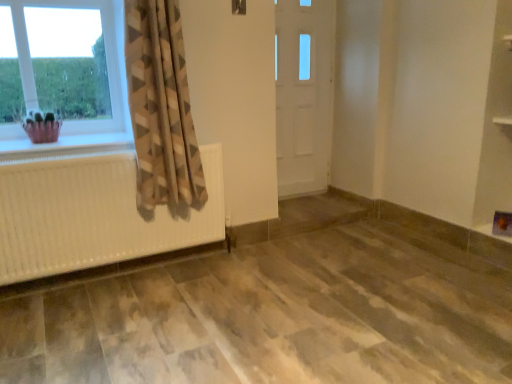
Locate an element on the screen. The height and width of the screenshot is (384, 512). white textured radiator at left is located at coordinates (94, 215).

The height and width of the screenshot is (384, 512). What do you see at coordinates (42, 127) in the screenshot?
I see `pink fabric basket at left` at bounding box center [42, 127].

The height and width of the screenshot is (384, 512). Describe the element at coordinates (65, 146) in the screenshot. I see `white textured radiator at left` at that location.

You are a GUI agent. You are given a task and a screenshot of the screen. Output one action in this format:
    pyautogui.click(x=<x>, y=<y>)
    Task: Click on the beige textured curtain at left
    The width and height of the screenshot is (512, 384).
    Given the screenshot: What is the action you would take?
    pyautogui.click(x=161, y=106)

In order to face clear glass window at upper left, should I rotate leftwards or rightwards?

You should rotate left by 25.451 degrees.

The image size is (512, 384). Find the location of `white textured radiator at left`. white textured radiator at left is located at coordinates (94, 215).

Based on the photo, between pink fabric basket at left and clear glass window at upper left, which one appears on the right side from the viewer's perspective?

pink fabric basket at left is more to the right.

Considering the relative sizes of pink fabric basket at left and clear glass window at upper left in the image provided, is pink fabric basket at left thinner than clear glass window at upper left?

Incorrect, the width of pink fabric basket at left is not less than that of clear glass window at upper left.

Could you tell me if pink fabric basket at left is facing clear glass window at upper left?

No, pink fabric basket at left is not oriented towards clear glass window at upper left.

Looking at this image, which of these two, white textured radiator at left or beige textured curtain at left, is smaller?

Smaller between the two is white textured radiator at left.

From the image's perspective, is white textured radiator at left located above beige textured curtain at left?

No, from the image's perspective, white textured radiator at left is not over beige textured curtain at left.

Would you say white textured radiator at left is a long distance from beige textured curtain at left?

No.

From a real-world perspective, is white textured radiator at left positioned above or below beige textured curtain at left?

From a real-world perspective, white textured radiator at left is physically below beige textured curtain at left.

Which object is closer to the camera, white textured radiator at left or beige textured curtain at left?

Positioned in front is beige textured curtain at left.

Consider the image. Considering the sizes of objects white textured radiator at left and beige textured curtain at left in the image provided, who is bigger, white textured radiator at left or beige textured curtain at left?

With larger size is beige textured curtain at left.

Between white textured radiator at left and beige textured curtain at left, which one has larger width?

white textured radiator at left is wider.

Between white textured radiator at left and beige textured curtain at left, which one appears on the right side from the viewer's perspective?

beige textured curtain at left is more to the right.

I want to click on door that is under the clear glass window at upper left (from a real-world perspective), so click(x=303, y=94).

Would you consider white wooden door at center to be distant from clear glass window at upper left?

white wooden door at center is positioned a significant distance from clear glass window at upper left.

Is white wooden door at center inside or outside of clear glass window at upper left?

The correct answer is: outside.

Considering the relative sizes of pink fabric basket at left and white textured radiator at left in the image provided, is pink fabric basket at left taller than white textured radiator at left?

No.

From the image's perspective, does pink fabric basket at left appear lower than white textured radiator at left?

No, from the image's perspective, pink fabric basket at left is not beneath white textured radiator at left.

Can you tell me how much pink fabric basket at left and white textured radiator at left differ in facing direction?

The angle between the facing direction of pink fabric basket at left and the facing direction of white textured radiator at left is 0.644 degrees.

From a real-world perspective, who is located higher, pink fabric basket at left or white textured radiator at left?

From a 3D spatial view, pink fabric basket at left is above.

Does white textured radiator at left have a lesser height compared to pink fabric basket at left?

Incorrect, the height of white textured radiator at left does not fall short of that of pink fabric basket at left.

Considering the sizes of objects white textured radiator at left and pink fabric basket at left in the image provided, who is wider, white textured radiator at left or pink fabric basket at left?

pink fabric basket at left.

From a real-world perspective, who is located lower, white textured radiator at left or pink fabric basket at left?

white textured radiator at left.

Considering the positions of objects white textured radiator at left and pink fabric basket at left in the image provided, who is more to the left, white textured radiator at left or pink fabric basket at left?

Positioned to the left is pink fabric basket at left.

Is white textured radiator at left positioned before white wooden door at center?

Yes, white textured radiator at left is closer to the camera.

Who is bigger, white textured radiator at left or white wooden door at center?

Bigger between the two is white wooden door at center.

Considering the points (111, 144) and (324, 190), which point is behind, point (111, 144) or point (324, 190)?

The point (324, 190) is behind.

You are a GUI agent. You are given a task and a screenshot of the screen. Output one action in this format:
    pyautogui.click(x=<x>, y=<y>)
    Task: Click on the plant located in front of the clear glass window at upper left
    Image resolution: width=512 pixels, height=384 pixels.
    Given the screenshot: What is the action you would take?
    42,127

This screenshot has height=384, width=512. In order to click on radiator below the beige textured curtain at left (from the image's perspective) in this screenshot , I will do `click(94, 215)`.

Based on their spatial positions, is white textured radiator at left or white wooden door at center further from pink fabric basket at left?

The object further to pink fabric basket at left is white wooden door at center.

Based on their spatial positions, is white textured radiator at left or beige textured curtain at left closer to white wooden door at center?

Based on the image, beige textured curtain at left appears to be nearer to white wooden door at center.

Which object lies nearer to the anchor point white textured radiator at left, white textured radiator at left or clear glass window at upper left?

Based on the image, white textured radiator at left appears to be nearer to white textured radiator at left.

Which object lies nearer to the anchor point beige textured curtain at left, clear glass window at upper left or white textured radiator at left?

white textured radiator at left is closer to beige textured curtain at left.

Considering their positions, is clear glass window at upper left positioned further to beige textured curtain at left than white textured radiator at left?

Among the two, clear glass window at upper left is located further to beige textured curtain at left.

Considering their positions, is clear glass window at upper left positioned closer to pink fabric basket at left than beige textured curtain at left?

clear glass window at upper left.

Estimate the real-world distances between objects in this image. Which object is further from pink fabric basket at left, beige textured curtain at left or white wooden door at center?

white wooden door at center lies further to pink fabric basket at left than the other object.

Estimate the real-world distances between objects in this image. Which object is further from pink fabric basket at left, white textured radiator at left or white wooden door at center?

white wooden door at center is positioned further to the anchor pink fabric basket at left.

What are the coordinates of `plant situated between clear glass window at upper left and white wooden door at center from left to right` in the screenshot? It's located at (42, 127).

You are a GUI agent. You are given a task and a screenshot of the screen. Output one action in this format:
    pyautogui.click(x=<x>, y=<y>)
    Task: Click on the radiator located between pink fabric basket at left and beige textured curtain at left in the left-right direction
    The height and width of the screenshot is (384, 512).
    Given the screenshot: What is the action you would take?
    pyautogui.click(x=94, y=215)

Where is `plant between clear glass window at upper left and white textured radiator at left from top to bottom`? This screenshot has width=512, height=384. plant between clear glass window at upper left and white textured radiator at left from top to bottom is located at coordinates (42, 127).

Identify the location of window sill between clear glass window at upper left and beige textured curtain at left in the horizontal direction. (65, 146).